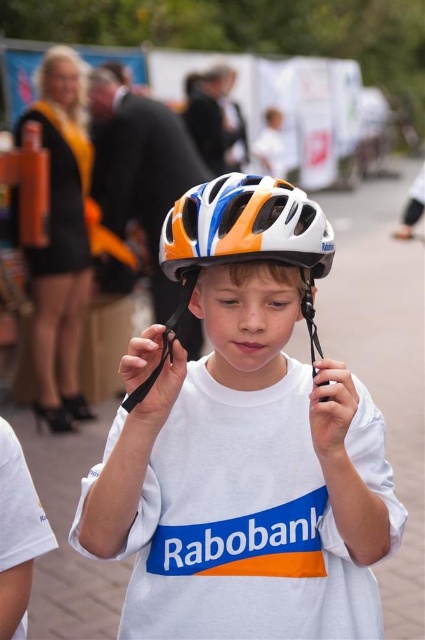
Based on the photo, you are a photographer at a graduation ceremony. You need to capture a photo where the shiny multicolored helmet at center and the matte black dress at upper left are both visible. Which object will appear larger in the photo?

The shiny multicolored helmet at center will appear larger in the photo because it is closer to the viewer than the matte black dress at upper left.